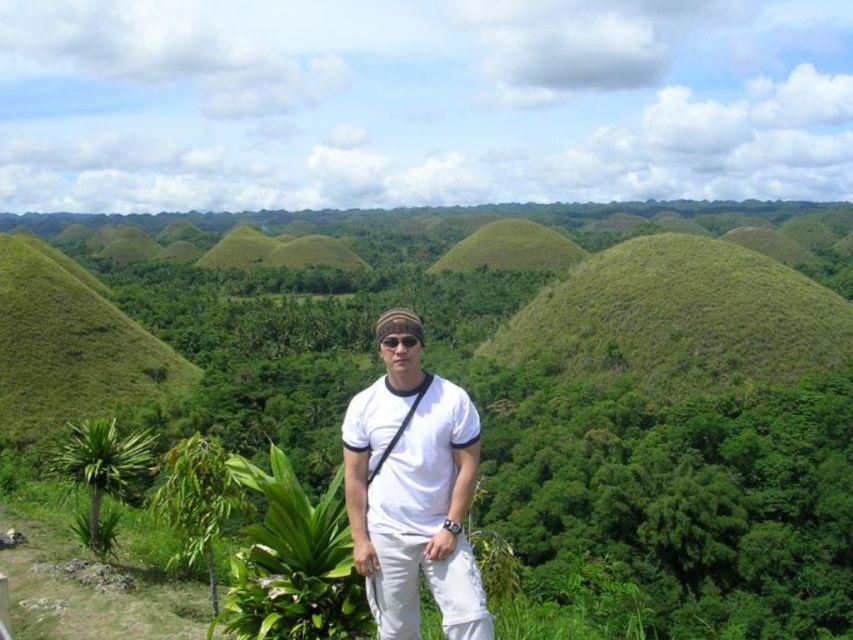
Question: Is green leafy vegetation at center positioned at the back of green grassy mound at center-right?

Choices:
 (A) no
 (B) yes

Answer: (A)

Question: Which point is farther to the camera?

Choices:
 (A) green leafy vegetation at center
 (B) green grassy hill at center
 (C) black matte sunglasses at center

Answer: (B)

Question: Is green grassy hill at center bigger than black matte sunglasses at center?

Choices:
 (A) yes
 (B) no

Answer: (A)

Question: Does green grassy mound at center-right lie in front of green grassy hill at center?

Choices:
 (A) no
 (B) yes

Answer: (B)

Question: Among these points, which one is nearest to the camera?

Choices:
 (A) (550, 252)
 (B) (698, 554)
 (C) (419, 342)
 (D) (683, 388)

Answer: (C)

Question: Among these points, which one is nearest to the camera?

Choices:
 (A) (701, 372)
 (B) (396, 346)
 (C) (460, 556)

Answer: (C)